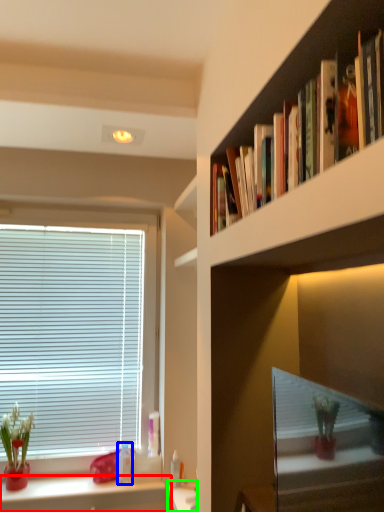
Question: Which object is positioned closest to cabinetry (highlighted by a red box)? Select from toiletry (highlighted by a blue box) and vanity (highlighted by a green box).

Choices:
 (A) toiletry
 (B) vanity

Answer: (A)